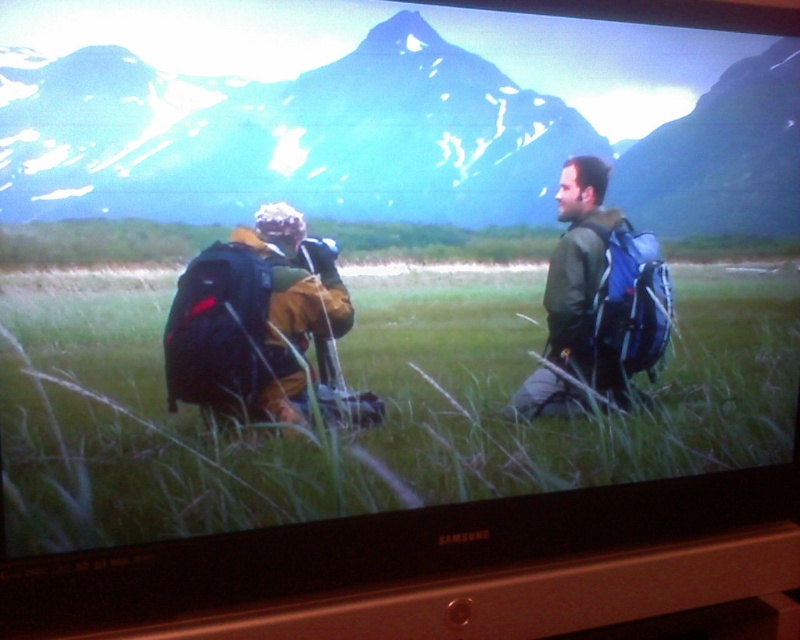
Does green grass at center come behind matte black backpack at center?

No, green grass at center is closer to the viewer.

Does green grass at center appear on the right side of matte black backpack at center?

Incorrect, green grass at center is not on the right side of matte black backpack at center.

Between point (250, 440) and point (654, 301), which one is positioned in front?

Point (250, 440)

Find the location of a particular element. This screenshot has width=800, height=640. green grass at center is located at coordinates (374, 392).

Is sleek blue mountain at upper center smaller than green grass at center?

Yes, sleek blue mountain at upper center is smaller than green grass at center.

Is sleek blue mountain at upper center taller than green grass at center?

No, sleek blue mountain at upper center is not taller than green grass at center.

Does point (444, 122) come behind point (126, 333)?

That is True.

The width and height of the screenshot is (800, 640). Find the location of `sleek blue mountain at upper center`. sleek blue mountain at upper center is located at coordinates (386, 113).

Between green grass at center and green matte jacket at right, which one appears on the left side from the viewer's perspective?

From the viewer's perspective, green grass at center appears more on the left side.

Can you confirm if green grass at center is positioned below green matte jacket at right?

Indeed, green grass at center is positioned under green matte jacket at right.

This screenshot has width=800, height=640. Describe the element at coordinates (374, 392) in the screenshot. I see `green grass at center` at that location.

You are a GUI agent. You are given a task and a screenshot of the screen. Output one action in this format:
    pyautogui.click(x=<x>, y=<y>)
    Task: Click on the green grass at center
    The image size is (800, 640).
    Given the screenshot: What is the action you would take?
    pyautogui.click(x=374, y=392)